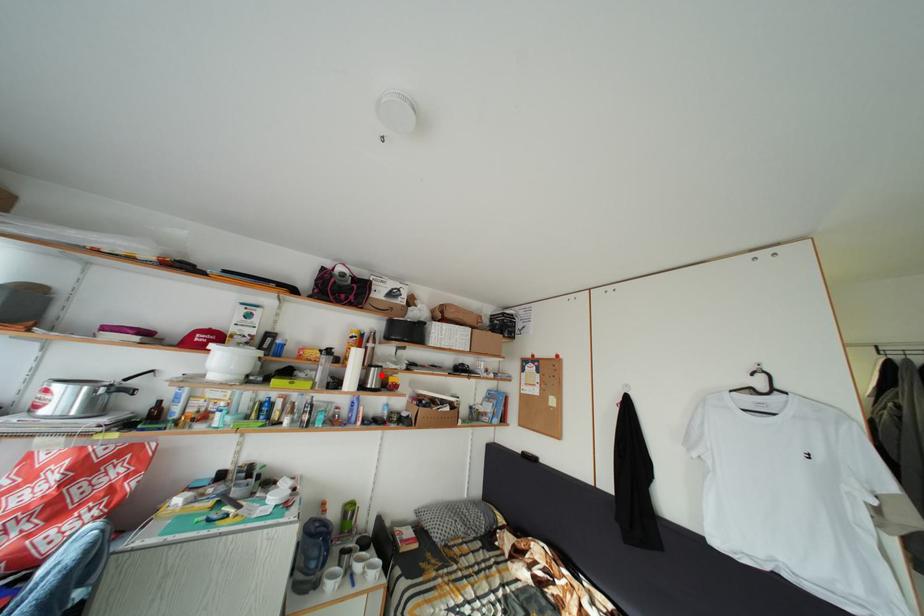
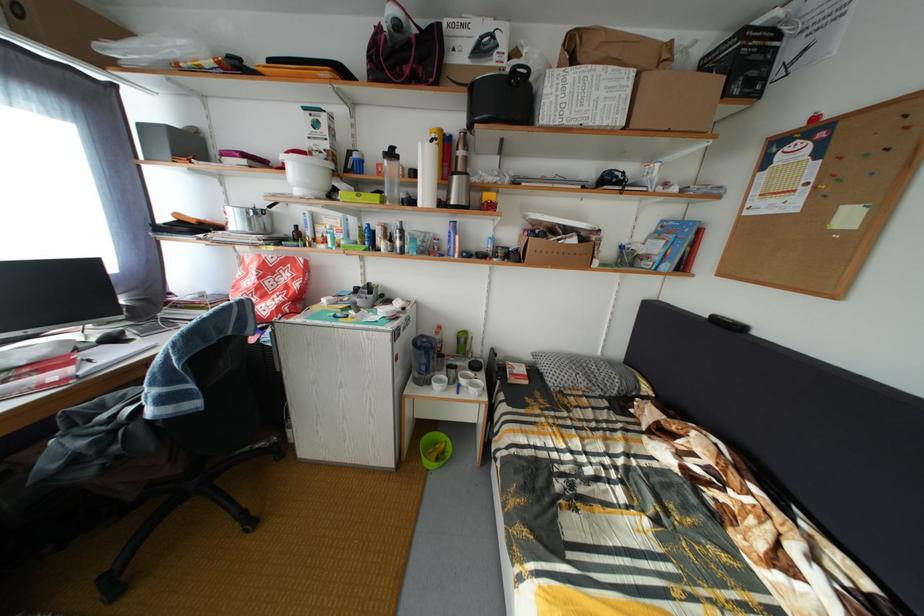
Question: I am providing you with two images of the same scene from different viewpoints. A red point is shown in image1. For the corresponding object point in image2, is it positioned nearer or farther from the camera?

Choices:
 (A) Nearer
 (B) Farther

Answer: (A)